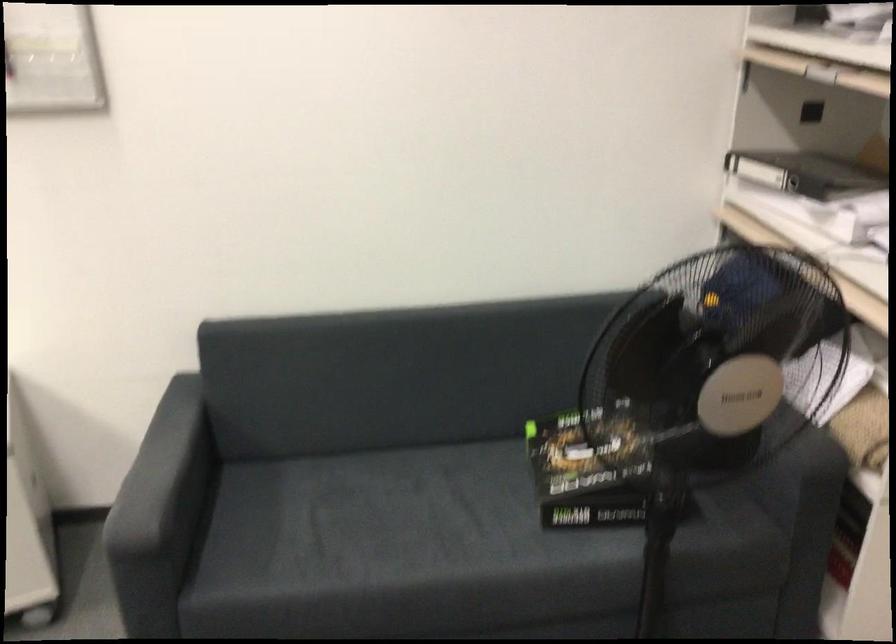
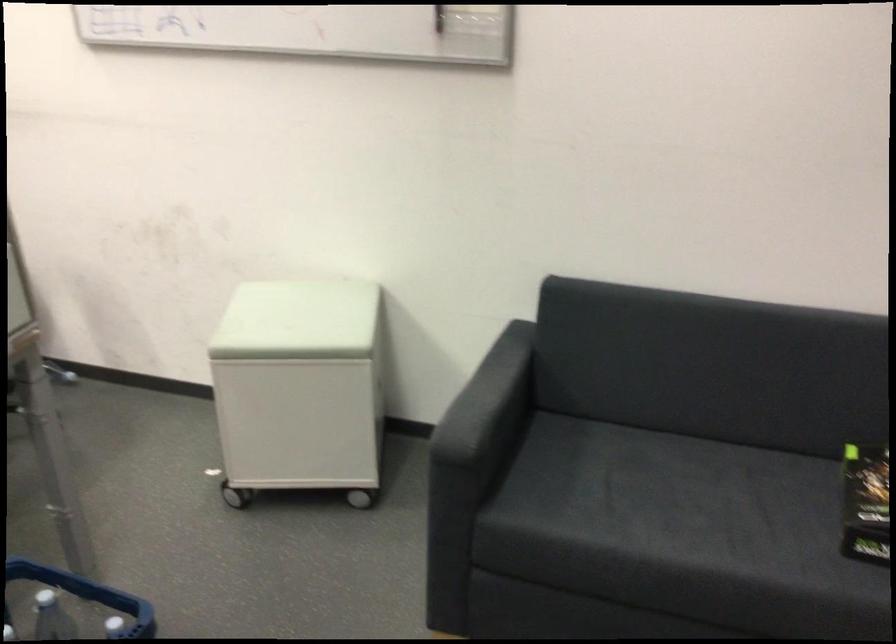
Locate, in the second image, the point that corresponds to (165,477) in the first image.

(487, 401)